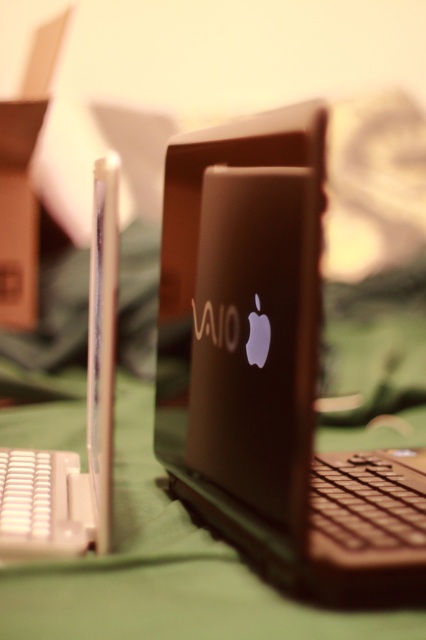
Question: Where is satin black laptop at center located in relation to satin black laptop at left in the image?

Choices:
 (A) below
 (B) above

Answer: (B)

Question: Can you confirm if satin black laptop at center is wider than satin black laptop at left?

Choices:
 (A) no
 (B) yes

Answer: (B)

Question: Among these objects, which one is farthest from the camera?

Choices:
 (A) satin black laptop at left
 (B) satin black laptop at center

Answer: (A)

Question: Considering the relative positions of satin black laptop at center and satin black laptop at left in the image provided, where is satin black laptop at center located with respect to satin black laptop at left?

Choices:
 (A) below
 (B) above

Answer: (B)